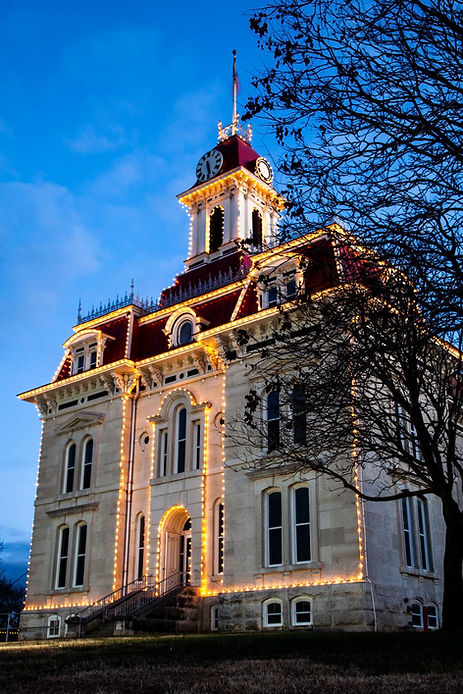
You are a GUI agent. You are given a task and a screenshot of the screen. Output one action in this format:
    pyautogui.click(x=<x>, y=<y>)
    Task: Click on the stair railing
    This screenshot has width=463, height=694.
    Given the screenshot: What is the action you would take?
    pyautogui.click(x=110, y=595), pyautogui.click(x=157, y=590)